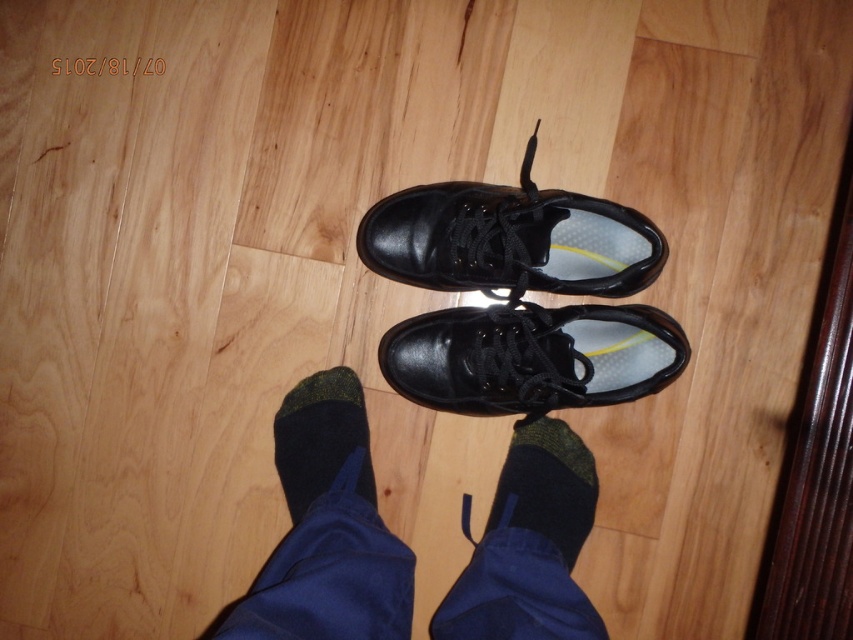
Question: Is black leather socks at lower center closer to camera compared to black leather shoe at center?

Choices:
 (A) no
 (B) yes

Answer: (B)

Question: Is black leather socks at lower center positioned in front of black leather shoe at center?

Choices:
 (A) yes
 (B) no

Answer: (A)

Question: Considering the real-world distances, which object is closest to the dark green knit sock at lower center?

Choices:
 (A) black leather socks at lower center
 (B) dark green knit sock at center
 (C) shiny black shoe at center

Answer: (A)

Question: In this image, where is shiny black shoe at center located relative to dark green knit sock at lower center?

Choices:
 (A) below
 (B) above

Answer: (B)

Question: Which point appears farthest from the camera in this image?

Choices:
 (A) (642, 257)
 (B) (352, 440)
 (C) (636, 323)

Answer: (B)

Question: Which object appears farthest from the camera in this image?

Choices:
 (A) black leather socks at lower center
 (B) black leather shoe at center
 (C) dark green knit sock at center
 (D) shiny black shoe at center

Answer: (C)